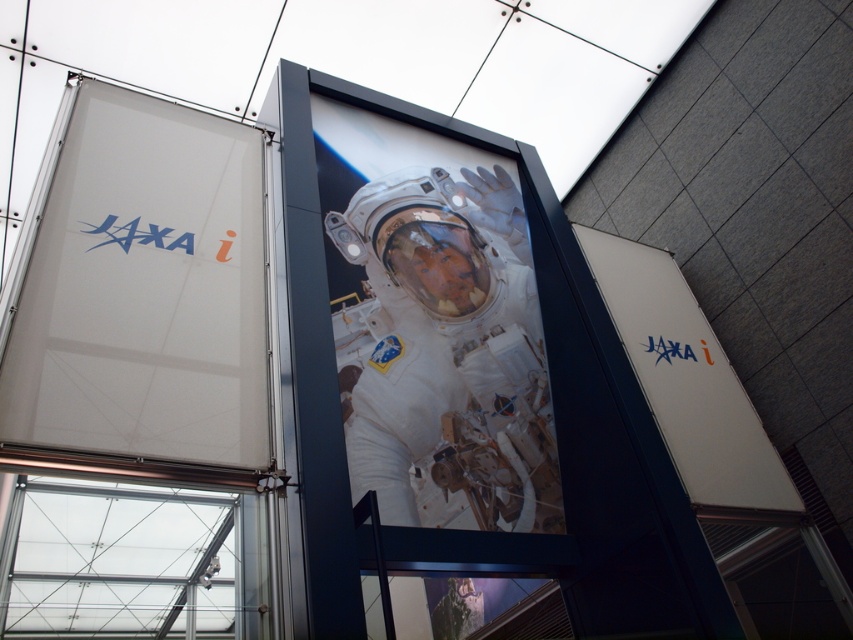
Question: Is white matte astronaut at center further to camera compared to white matte sign at center?

Choices:
 (A) no
 (B) yes

Answer: (A)

Question: Is white fabric sign at upper left closer to camera compared to white matte astronaut at center?

Choices:
 (A) yes
 (B) no

Answer: (A)

Question: Among these points, which one is nearest to the camera?

Choices:
 (A) (149, 376)
 (B) (721, 358)
 (C) (337, 346)

Answer: (A)

Question: Does white matte astronaut at center have a lesser width compared to white matte sign at center?

Choices:
 (A) no
 (B) yes

Answer: (A)

Question: Based on their relative distances, which object is nearer to the white matte astronaut at center?

Choices:
 (A) white matte sign at center
 (B) white fabric sign at upper left

Answer: (B)

Question: Which point is farther to the camera?

Choices:
 (A) (647, 252)
 (B) (461, 392)

Answer: (A)